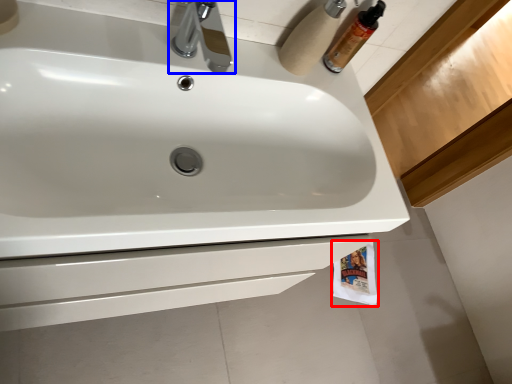
Question: Which of the following is the farthest to the observer, toilet paper (highlighted by a red box) or tap (highlighted by a blue box)?

Choices:
 (A) toilet paper
 (B) tap

Answer: (A)